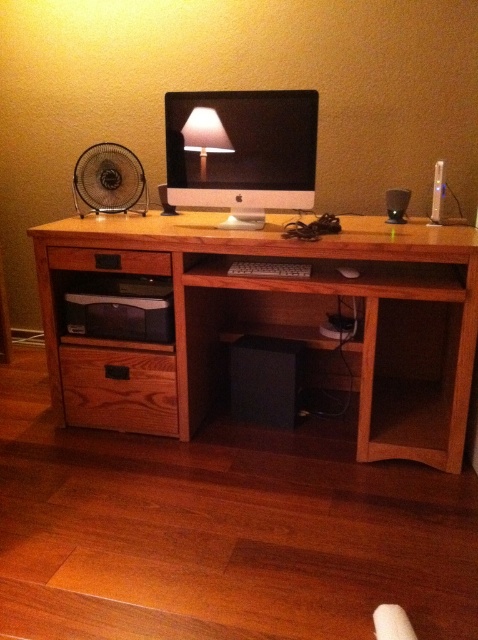
Question: Does black plastic fan at left appear under matte white lampshade at upper center?

Choices:
 (A) yes
 (B) no

Answer: (A)

Question: Which object appears farthest from the camera in this image?

Choices:
 (A) wooden computer desk at center
 (B) brown wood drawer at lower left

Answer: (B)

Question: From the image, what is the correct spatial relationship of satin white monitor at center in relation to matte white lampshade at upper center?

Choices:
 (A) left
 (B) right

Answer: (B)

Question: Estimate the real-world distances between objects in this image. Which object is closer to the pine wood drawer at lower left?

Choices:
 (A) matte white lampshade at upper center
 (B) black plastic fan at left
 (C) brown wood drawer at lower left

Answer: (C)

Question: Estimate the real-world distances between objects in this image. Which object is farther from the wooden computer desk at center?

Choices:
 (A) matte white lampshade at upper center
 (B) satin white monitor at center
 (C) black plastic fan at left

Answer: (A)

Question: Is black plastic fan at left smaller than matte white lampshade at upper center?

Choices:
 (A) yes
 (B) no

Answer: (B)